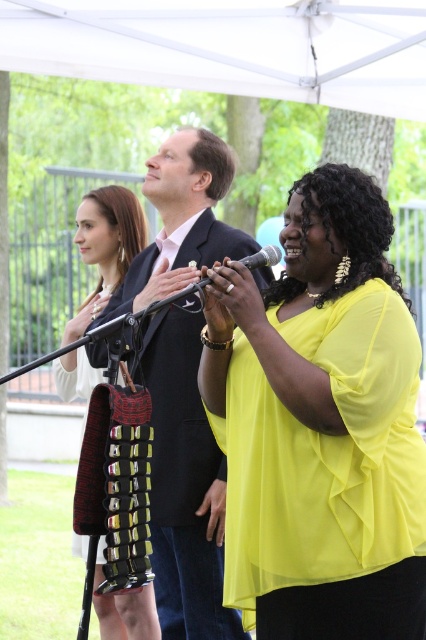
Is point (161, 397) closer to viewer compared to point (97, 228)?

Yes, point (161, 397) is in front of point (97, 228).

Does point (215, 228) lie behind point (135, 230)?

No, it is in front of (135, 230).

The image size is (426, 640). Identify the location of matte black suit at center. (184, 484).

Which is more to the right, white fabric canopy at upper center or black textured dress at left?

white fabric canopy at upper center

Is white fabric canopy at upper center to the right of black textured dress at left from the viewer's perspective?

Yes, white fabric canopy at upper center is to the right of black textured dress at left.

At what (x,y) coordinates should I click in order to perform the action: click on white fabric canopy at upper center. Please return your answer as a coordinate pair (x, y). This screenshot has width=426, height=640. Looking at the image, I should click on (230, 45).

Who is lower down, yellow sheer blouse at center or matte black suit at center?

yellow sheer blouse at center is lower down.

Is yellow sheer blouse at center smaller than matte black suit at center?

Yes.

Does point (325, 371) lie behind point (235, 636)?

No, (325, 371) is closer to viewer.

You are a GUI agent. You are given a task and a screenshot of the screen. Output one action in this format:
    pyautogui.click(x=<x>, y=<y>)
    Task: Click on the yellow sheer blouse at center
    This screenshot has height=640, width=426.
    Given the screenshot: What is the action you would take?
    pyautogui.click(x=321, y=424)